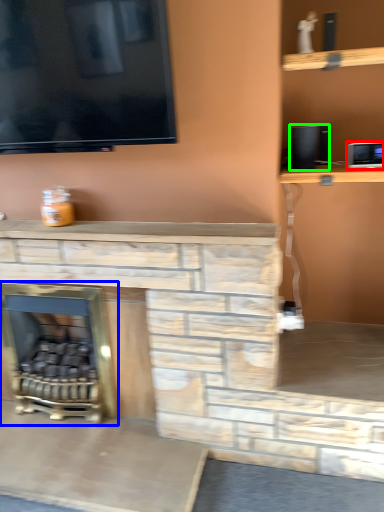
Question: Which is nearer to the appliance (highlighted by a red box)? fireplace (highlighted by a blue box) or speaker (highlighted by a green box).

Choices:
 (A) fireplace
 (B) speaker

Answer: (B)